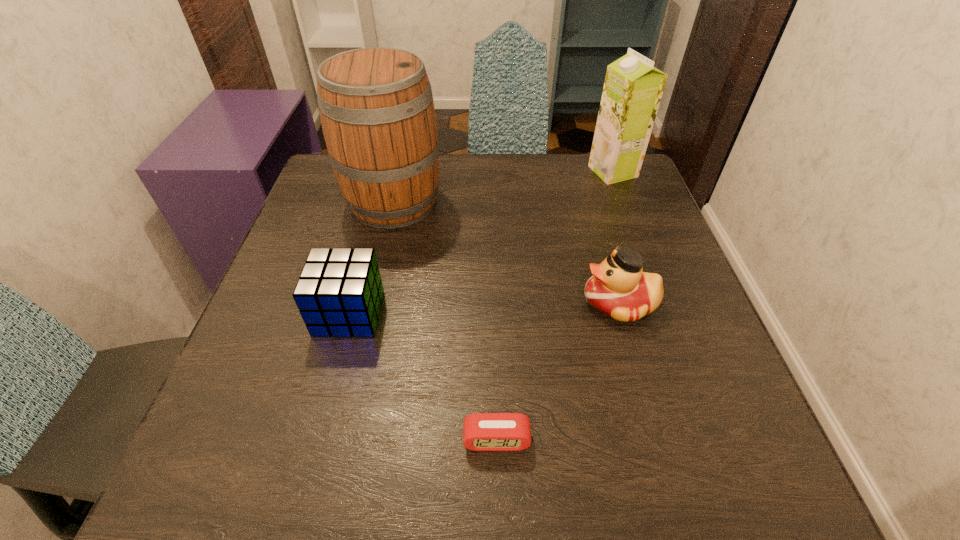
This screenshot has width=960, height=540. Identify the location of object located in the far right corner section of the desktop. (633, 87).

The width and height of the screenshot is (960, 540). I want to click on free location at the far edge, so click(x=506, y=195).

Locate an element on the screen. free point at the near edge is located at coordinates (431, 461).

Image resolution: width=960 pixels, height=540 pixels. In the image, there is a desktop. Find the location of `vacant space at the left edge`. vacant space at the left edge is located at coordinates (283, 347).

This screenshot has width=960, height=540. Identify the location of free space at the right edge of the desktop. (696, 369).

This screenshot has width=960, height=540. What are the coordinates of `vacant area at the near left corner of the desktop` in the screenshot? It's located at (305, 444).

Locate an element on the screen. free location at the near right corner is located at coordinates (709, 441).

Image resolution: width=960 pixels, height=540 pixels. What are the coordinates of `vacant space that is in between the soya milk and the duck` in the screenshot? It's located at (616, 237).

At what (x,y) coordinates should I click in order to perform the action: click on vacant area that lies between the shortest object and the cider. Please return your answer as a coordinate pair (x, y). The width and height of the screenshot is (960, 540). Looking at the image, I should click on (445, 321).

Locate an element on the screen. This screenshot has height=540, width=960. free space between the cider and the nearest object is located at coordinates (445, 321).